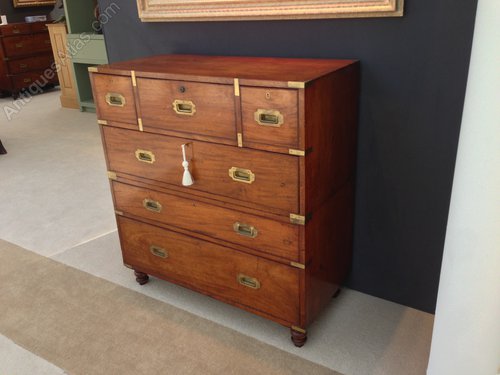
You are a GUI agent. You are given a task and a screenshot of the screen. Output one action in this format:
    pyautogui.click(x=<x>, y=<y>)
    Task: Click on the drawer
    This screenshot has width=500, height=375.
    Given the screenshot: What is the action you would take?
    pyautogui.click(x=293, y=194)